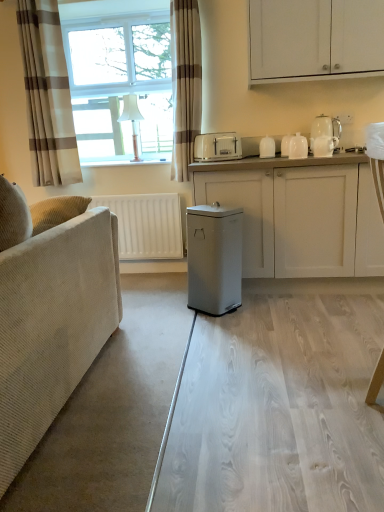
Measure the distance between point (68, 149) and camera.

10.40 feet.

What do you see at coordinates (47, 95) in the screenshot? The image size is (384, 512). I see `beige plaid curtain at upper left, which is the 1th curtain in left-to-right order` at bounding box center [47, 95].

Identify the location of white glossy coffee machine at upper right. The width and height of the screenshot is (384, 512). (324, 136).

Describe the element at coordinates (267, 147) in the screenshot. Image resolution: width=384 pixels, height=512 pixels. I see `white glossy teapot at upper right, which is the 2th appliance from left to right` at that location.

At what (x,y) coordinates should I click in order to perform the action: click on beige plaid curtain at upper left, positioned as the second curtain in left-to-right order. Please return your answer as a coordinate pair (x, y). Looking at the image, I should click on (185, 83).

You are a GUI agent. You are given a task and a screenshot of the screen. Output one action in this format:
    pyautogui.click(x=<x>, y=<y>)
    Task: Click on the beige plaid curtain at upper left, which is the 1th curtain in left-to-right order
    The image size is (384, 512).
    Given the screenshot: What is the action you would take?
    pos(47,95)

From the picture: Is white plastic toaster at center, the first appliance from the left, positioned far away from transparent glass table at center?

Yes, white plastic toaster at center, the first appliance from the left, and transparent glass table at center are located far from each other.

How different are the orientations of white plastic toaster at center, placed as the 4th appliance when sorted from right to left, and transparent glass table at center in degrees?

The facing directions of white plastic toaster at center, placed as the 4th appliance when sorted from right to left, and transparent glass table at center are 121 degrees apart.

Which is in front, white plastic toaster at center, placed as the 4th appliance when sorted from right to left, or transparent glass table at center?

transparent glass table at center is in front.

Between white plastic toaster at center, placed as the 4th appliance when sorted from right to left, and transparent glass table at center, which one appears on the right side from the viewer's perspective?

transparent glass table at center.

Is point (54, 360) behind point (267, 137)?

No, it is not.

Is beige corduroy couch at left positioned beyond the bounds of white glossy teapot at upper right, placed as the 3th appliance when sorted from right to left?

Absolutely, beige corduroy couch at left is external to white glossy teapot at upper right, placed as the 3th appliance when sorted from right to left.

Considering the sizes of beige corduroy couch at left and white glossy teapot at upper right, which is the 2th appliance from left to right, in the image, is beige corduroy couch at left taller or shorter than white glossy teapot at upper right, which is the 2th appliance from left to right,?

Clearly, beige corduroy couch at left is taller compared to white glossy teapot at upper right, which is the 2th appliance from left to right.

Is white glossy coffee machine at upper right closer to the viewer compared to white glossy jar at upper right, acting as the 3th appliance starting from the left?

Yes.

From the image's perspective, is white glossy coffee machine at upper right positioned above or below white glossy jar at upper right, marked as the second appliance in a right-to-left arrangement?

Based on their image positions, white glossy coffee machine at upper right is located above white glossy jar at upper right, marked as the second appliance in a right-to-left arrangement.

Looking at this image, from a real-world perspective, is white glossy coffee machine at upper right located beneath white glossy jar at upper right, marked as the second appliance in a right-to-left arrangement?

Incorrect, from a real-world perspective, white glossy coffee machine at upper right is higher than white glossy jar at upper right, marked as the second appliance in a right-to-left arrangement.

The image size is (384, 512). I want to click on appliance below the white glossy coffee machine at upper right (from the image's perspective), so click(298, 147).

Which of these two, white matte cabinet at upper right, which ranks as the second cabinetry in bottom-to-top order, or white glossy teapot at upper right, which is the 2th appliance from left to right, is smaller?

With smaller size is white glossy teapot at upper right, which is the 2th appliance from left to right.

From the image's perspective, would you say white matte cabinet at upper right, positioned as the first cabinetry in top-to-bottom order, is shown under white glossy teapot at upper right, placed as the 3th appliance when sorted from right to left?

Actually, white matte cabinet at upper right, positioned as the first cabinetry in top-to-bottom order, appears above white glossy teapot at upper right, placed as the 3th appliance when sorted from right to left, in the image.

Is point (371, 21) closer or farther from the camera than point (268, 136)?

Clearly, point (371, 21) is closer to the camera than point (268, 136).

Is white glossy teapot at upper right, placed as the 3th appliance when sorted from right to left, surrounded by white plastic toaster at center, the first appliance from the left?

No, white glossy teapot at upper right, placed as the 3th appliance when sorted from right to left, is not inside white plastic toaster at center, the first appliance from the left.

Can you confirm if white plastic toaster at center, the first appliance from the left, is thinner than white glossy teapot at upper right, placed as the 3th appliance when sorted from right to left?

No.

Where is `the 1st appliance below the white plastic toaster at center, the first appliance from the left (from a real-world perspective)`? The image size is (384, 512). the 1st appliance below the white plastic toaster at center, the first appliance from the left (from a real-world perspective) is located at coordinates (267, 147).

Between metallic gray trash can at center and white plastic toaster at center, the first appliance from the left, which one appears on the right side from the viewer's perspective?

white plastic toaster at center, the first appliance from the left, is more to the right.

From the image's perspective, which one is positioned lower, metallic gray trash can at center or white plastic toaster at center, placed as the 4th appliance when sorted from right to left?

metallic gray trash can at center is shown below in the image.

Is the depth of metallic gray trash can at center greater than that of white plastic toaster at center, the first appliance from the left?

No, metallic gray trash can at center is closer to the viewer.

From a real-world perspective, is beige corduroy couch at left physically below beige plaid curtain at upper left, arranged as the 1th curtain when viewed from the right?

Correct, in the physical world, beige corduroy couch at left is lower than beige plaid curtain at upper left, arranged as the 1th curtain when viewed from the right.

Which object is more forward, beige corduroy couch at left or beige plaid curtain at upper left, positioned as the second curtain in left-to-right order?

beige corduroy couch at left is in front.

Can you confirm if beige corduroy couch at left is wider than beige plaid curtain at upper left, arranged as the 1th curtain when viewed from the right?

Correct, the width of beige corduroy couch at left exceeds that of beige plaid curtain at upper left, arranged as the 1th curtain when viewed from the right.

Considering the relative sizes of beige corduroy couch at left and beige plaid curtain at upper left, arranged as the 1th curtain when viewed from the right, in the image provided, is beige corduroy couch at left bigger than beige plaid curtain at upper left, arranged as the 1th curtain when viewed from the right,?

Correct, beige corduroy couch at left is larger in size than beige plaid curtain at upper left, arranged as the 1th curtain when viewed from the right.

Image resolution: width=384 pixels, height=512 pixels. In order to click on glass table that is in front of the white plastic toaster at center, the first appliance from the left in this screenshot , I will do `click(278, 404)`.

From a real-world perspective, count 3rd appliances upward from the beige corduroy couch at left and point to it. Please provide its 2D coordinates.

[(267, 147)]

When comparing their distances from white glossy cups at upper right, arranged as the first appliance when viewed from the right, does white glossy coffee machine at upper right or transparent glass table at center seem closer?

white glossy coffee machine at upper right is closer to white glossy cups at upper right, arranged as the first appliance when viewed from the right.

Based on their spatial positions, is white glossy coffee machine at upper right or white glossy jar at upper right, marked as the second appliance in a right-to-left arrangement, further from white matte cabinet at upper right, which ranks as the second cabinetry in bottom-to-top order?

white glossy jar at upper right, marked as the second appliance in a right-to-left arrangement, lies further to white matte cabinet at upper right, which ranks as the second cabinetry in bottom-to-top order, than the other object.

Considering their positions, is white matte cabinet at upper right, positioned as the first cabinetry in top-to-bottom order, positioned further to beige plaid curtain at upper left, positioned as the second curtain in left-to-right order, than metallic gray trash can at center?

metallic gray trash can at center lies further to beige plaid curtain at upper left, positioned as the second curtain in left-to-right order, than the other object.

Estimate the real-world distances between objects in this image. Which object is closer to transparent glass table at center, beige plaid curtain at upper left, positioned as the second curtain in left-to-right order, or white glossy jar at upper right, marked as the second appliance in a right-to-left arrangement?

white glossy jar at upper right, marked as the second appliance in a right-to-left arrangement, is positioned closer to the anchor transparent glass table at center.

Based on their spatial positions, is white glossy teapot at upper right, which is the 2th appliance from left to right, or white matte cabinet at center, the 2th cabinetry positioned from the top, further from beige corduroy couch at left?

white glossy teapot at upper right, which is the 2th appliance from left to right, lies further to beige corduroy couch at left than the other object.

Estimate the real-world distances between objects in this image. Which object is further from white matte cabinet at center, positioned as the 1th cabinetry in bottom-to-top order, white glossy jar at upper right, marked as the second appliance in a right-to-left arrangement, or white plastic toaster at center, the first appliance from the left?

white plastic toaster at center, the first appliance from the left, is positioned further to the anchor white matte cabinet at center, positioned as the 1th cabinetry in bottom-to-top order.

Estimate the real-world distances between objects in this image. Which object is closer to beige corduroy couch at left, white matte cabinet at upper right, which ranks as the second cabinetry in bottom-to-top order, or white matte radiator at left?

white matte radiator at left is positioned closer to the anchor beige corduroy couch at left.

Considering their positions, is white matte cabinet at upper right, positioned as the first cabinetry in top-to-bottom order, positioned closer to beige plaid curtain at upper left, arranged as the 1th curtain when viewed from the right, than white matte radiator at left?

Based on the image, white matte radiator at left appears to be nearer to beige plaid curtain at upper left, arranged as the 1th curtain when viewed from the right.

The image size is (384, 512). I want to click on cabinetry between white glossy teapot at upper right, placed as the 3th appliance when sorted from right to left, and metallic gray trash can at center from top to bottom, so click(x=300, y=214).

The image size is (384, 512). I want to click on radiator situated between beige plaid curtain at upper left, which ranks as the 2th curtain in right-to-left order, and white matte cabinet at center, the 2th cabinetry positioned from the top, from left to right, so click(x=146, y=225).

This screenshot has width=384, height=512. Find the location of `curtain between beige plaid curtain at upper left, which is the 1th curtain in left-to-right order, and white glossy jar at upper right, acting as the 3th appliance starting from the left`. curtain between beige plaid curtain at upper left, which is the 1th curtain in left-to-right order, and white glossy jar at upper right, acting as the 3th appliance starting from the left is located at coordinates (185, 83).

Where is `appliance between beige corduroy couch at left and beige plaid curtain at upper left, arranged as the 1th curtain when viewed from the right, along the z-axis`? The width and height of the screenshot is (384, 512). appliance between beige corduroy couch at left and beige plaid curtain at upper left, arranged as the 1th curtain when viewed from the right, along the z-axis is located at coordinates (298, 147).